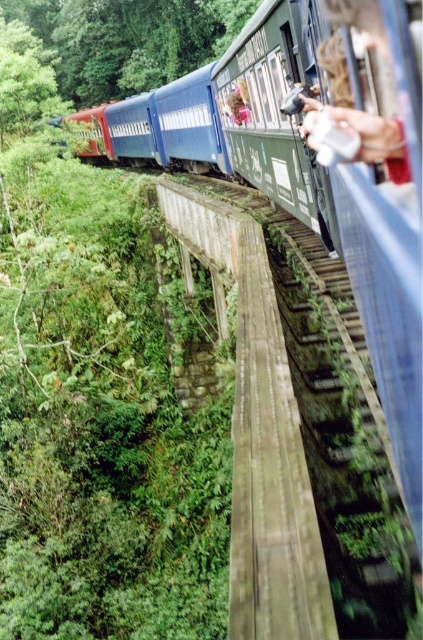
Based on the photo, you are a passenger on the train and want to take a photo of the green leafy tree at upper left. The point you need to focus on is at coordinates point (x=129, y=38). Is this point located on the tree?

Yes, the point (x=129, y=38) is located on the green leafy tree at upper left.